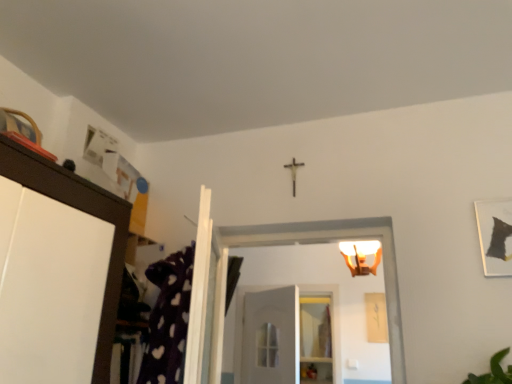
The width and height of the screenshot is (512, 384). Describe the element at coordinates (315, 340) in the screenshot. I see `clear glass shelf at center` at that location.

The width and height of the screenshot is (512, 384). What do you see at coordinates (271, 337) in the screenshot? I see `white matte door at center` at bounding box center [271, 337].

Measure the distance between point (506, 271) and camera.

1.67 meters.

This screenshot has height=384, width=512. I want to click on matte white light fixture at upper center, so click(361, 256).

Considering the positions of objects matte white light fixture at upper center and white matte door at center in the image provided, who is more to the right, matte white light fixture at upper center or white matte door at center?

From the viewer's perspective, matte white light fixture at upper center appears more on the right side.

Is matte white light fixture at upper center touching white matte door at center?

matte white light fixture at upper center is not next to white matte door at center, and they're not touching.

In order to click on light fixture in front of the white matte door at center in this screenshot , I will do `click(361, 256)`.

From the image's perspective, which is above, matte white light fixture at upper center or white matte door at center?

From the image's view, matte white light fixture at upper center is above.

Which object is further away from the camera taking this photo, matte white light fixture at upper center or matte black picture frame at upper right?

matte white light fixture at upper center is further from the camera.

I want to click on light fixture below the matte black picture frame at upper right (from the image's perspective), so click(361, 256).

From the image's perspective, which one is positioned higher, matte white light fixture at upper center or matte black picture frame at upper right?

From the image's view, matte black picture frame at upper right is above.

Considering the relative sizes of matte white light fixture at upper center and matte black picture frame at upper right in the image provided, is matte white light fixture at upper center thinner than matte black picture frame at upper right?

In fact, matte white light fixture at upper center might be wider than matte black picture frame at upper right.

Would you say matte black picture frame at upper right is to the left or to the right of clear glass shelf at center in the picture?

matte black picture frame at upper right is to the right of clear glass shelf at center.

How much distance is there between matte black picture frame at upper right and clear glass shelf at center?

A distance of 2.43 meters exists between matte black picture frame at upper right and clear glass shelf at center.

In the scene shown: From the image's perspective, between matte black picture frame at upper right and clear glass shelf at center, which one is located above?

matte black picture frame at upper right, from the image's perspective.

Is matte black picture frame at upper right inside or outside of clear glass shelf at center?

matte black picture frame at upper right exists outside the volume of clear glass shelf at center.

Considering the relative sizes of white matte door at center and matte white light fixture at upper center in the image provided, is white matte door at center shorter than matte white light fixture at upper center?

No.

Is white matte door at center behind matte white light fixture at upper center?

Yes, the depth of white matte door at center is greater than that of matte white light fixture at upper center.

Visually, is white matte door at center positioned to the left or to the right of matte white light fixture at upper center?

white matte door at center is to the left of matte white light fixture at upper center.

Is white matte door at center next to matte white light fixture at upper center and touching it?

No.

From a real-world perspective, between matte black picture frame at upper right and white matte door at center, who is vertically lower?

white matte door at center, from a real-world perspective.

Considering the sizes of objects matte black picture frame at upper right and white matte door at center in the image provided, who is shorter, matte black picture frame at upper right or white matte door at center?

matte black picture frame at upper right is shorter.

From the image's perspective, is matte black picture frame at upper right positioned above or below white matte door at center?

Clearly, from the image's perspective, matte black picture frame at upper right is above white matte door at center.

Is matte black picture frame at upper right positioned before white matte door at center?

Yes, matte black picture frame at upper right is closer to the viewer.

Between clear glass shelf at center and matte black picture frame at upper right, which one appears on the left side from the viewer's perspective?

From the viewer's perspective, clear glass shelf at center appears more on the left side.

From a real-world perspective, which is physically below, clear glass shelf at center or matte black picture frame at upper right?

From a 3D spatial view, clear glass shelf at center is below.

Consider the image. How different are the orientations of clear glass shelf at center and matte black picture frame at upper right in degrees?

The facing directions of clear glass shelf at center and matte black picture frame at upper right are 9.36 degrees apart.

Is matte black picture frame at upper right placed right next to matte white light fixture at upper center?

No.

Does matte black picture frame at upper right have a greater width compared to matte white light fixture at upper center?

No, matte black picture frame at upper right is not wider than matte white light fixture at upper center.

Is matte black picture frame at upper right taller than matte white light fixture at upper center?

Yes.

Where is `light fixture above the white matte door at center (from the image's perspective)`? The height and width of the screenshot is (384, 512). light fixture above the white matte door at center (from the image's perspective) is located at coordinates (361, 256).

The image size is (512, 384). What are the coordinates of `light fixture above the matte black picture frame at upper right (from a real-world perspective)` in the screenshot? It's located at (361, 256).

Looking at this image, looking at the image, which one is located further to clear glass shelf at center, matte black picture frame at upper right or white matte door at center?

matte black picture frame at upper right.

Looking at the image, which one is located further to matte black picture frame at upper right, clear glass shelf at center or matte white light fixture at upper center?

clear glass shelf at center is further to matte black picture frame at upper right.

Based on their spatial positions, is matte black picture frame at upper right or white matte door at center closer to matte white light fixture at upper center?

white matte door at center is positioned closer to the anchor matte white light fixture at upper center.

When comparing their distances from matte black picture frame at upper right, does white matte door at center or clear glass shelf at center seem further?

clear glass shelf at center lies further to matte black picture frame at upper right than the other object.

When comparing their distances from white matte door at center, does matte black picture frame at upper right or matte white light fixture at upper center seem closer?

matte white light fixture at upper center is closer to white matte door at center.

Looking at this image, estimate the real-world distances between objects in this image. Which object is closer to matte black picture frame at upper right, clear glass shelf at center or white matte door at center?

Based on the image, white matte door at center appears to be nearer to matte black picture frame at upper right.

Considering their positions, is matte black picture frame at upper right positioned closer to white matte door at center than clear glass shelf at center?

clear glass shelf at center.

Which object lies nearer to the anchor point white matte door at center, matte white light fixture at upper center or clear glass shelf at center?

clear glass shelf at center is positioned closer to the anchor white matte door at center.

Where is `light fixture between matte black picture frame at upper right and white matte door at center along the z-axis`? The width and height of the screenshot is (512, 384). light fixture between matte black picture frame at upper right and white matte door at center along the z-axis is located at coordinates (361, 256).

Find the location of a particular element. Image resolution: width=512 pixels, height=384 pixels. door between matte white light fixture at upper center and clear glass shelf at center in the front-back direction is located at coordinates (271, 337).

Locate an element on the screen. The width and height of the screenshot is (512, 384). light fixture between matte black picture frame at upper right and clear glass shelf at center in the front-back direction is located at coordinates (361, 256).

You are a GUI agent. You are given a task and a screenshot of the screen. Output one action in this format:
    pyautogui.click(x=<x>, y=<y>)
    Task: Click on the door between matte black picture frame at upper right and clear glass shelf at center along the z-axis
    
    Given the screenshot: What is the action you would take?
    (x=271, y=337)